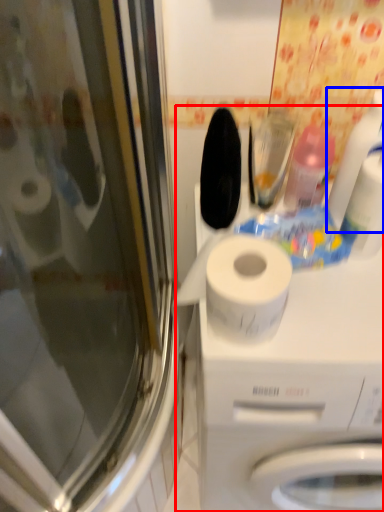
Question: Which point is further to the camera, machine (highlighted by a red box) or cleaning product (highlighted by a blue box)?

Choices:
 (A) machine
 (B) cleaning product

Answer: (B)